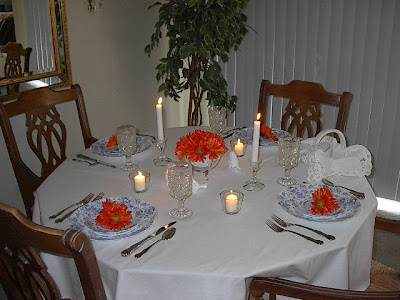
In order to click on knives in this screenshot , I will do `click(107, 163)`, `click(224, 137)`, `click(304, 181)`, `click(141, 239)`.